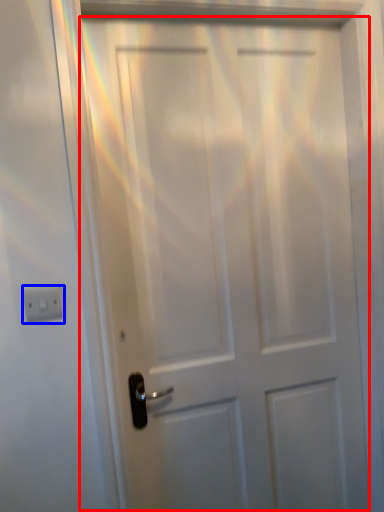
Question: Which object appears closest to the camera in this image, door (highlighted by a red box) or light switch (highlighted by a blue box)?

Choices:
 (A) door
 (B) light switch

Answer: (B)